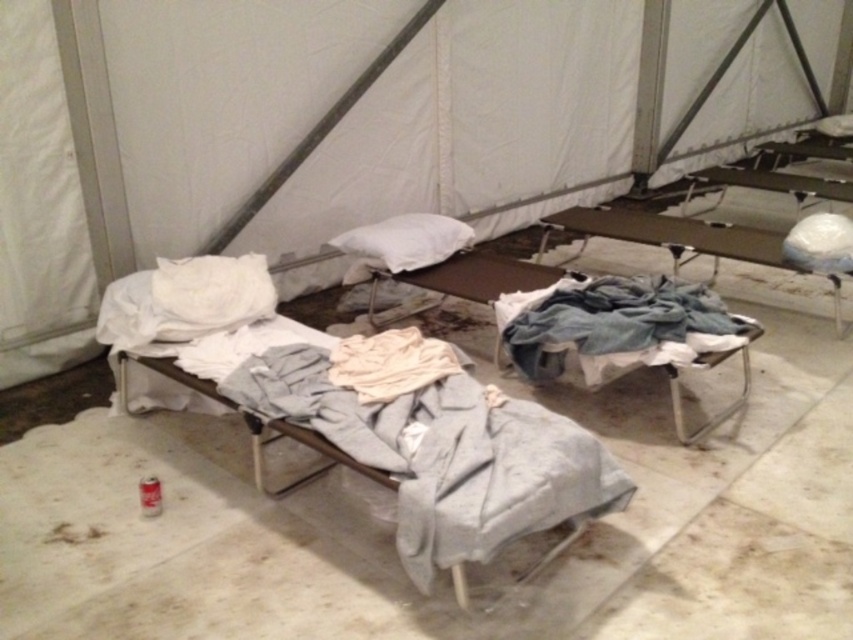
You are setting up a temporary shelter and need to place a 1.2 meter tall storage box. The metallic gray bed frame at center and the white soft pillow at center are in the way. Which object should you move to make space?

The metallic gray bed frame at center is taller than the white soft pillow at center, so you should move the metallic gray bed frame at center to make space for the storage box since it is the taller object and might be blocking the necessary height.

You are setting up a temporary shelter and need to place a small red can on the bed. The metallic gray bed frame at center and the white soft pillow at center are both in your way. Which object should you move to access the bed first?

The metallic gray bed frame at center is closer to the viewer than the white soft pillow at center, so you should move the metallic gray bed frame at center first to access the bed.

You are setting up a temporary shelter and need to place a small red can between the gray fabric bed frame at center and the white soft pillow at center. Which object should you place the can closer to if you want it to be nearer to the viewer?

To place the small red can closer to the viewer, you should position it near the gray fabric bed frame at center since it is closer to the viewer than the white soft pillow at center.